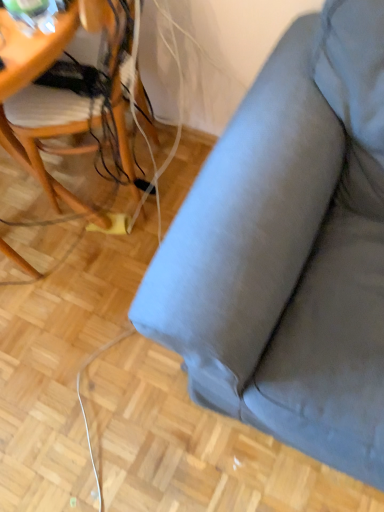
Question: From the image's perspective, is woodenchair at left below matte gray fabric couch at upper right?

Choices:
 (A) yes
 (B) no

Answer: (B)

Question: Is woodenchair at left taller than matte gray fabric couch at upper right?

Choices:
 (A) yes
 (B) no

Answer: (B)

Question: Can you confirm if woodenchair at left is wider than matte gray fabric couch at upper right?

Choices:
 (A) yes
 (B) no

Answer: (B)

Question: Could you tell me if woodenchair at left is turned towards matte gray fabric couch at upper right?

Choices:
 (A) no
 (B) yes

Answer: (A)

Question: Is woodenchair at left smaller than matte gray fabric couch at upper right?

Choices:
 (A) no
 (B) yes

Answer: (B)

Question: Is woodenchair at left to the right of matte gray fabric couch at upper right from the viewer's perspective?

Choices:
 (A) yes
 (B) no

Answer: (B)

Question: Is matte gray fabric couch at upper right smaller than woodenchair at left?

Choices:
 (A) yes
 (B) no

Answer: (B)

Question: Can we say matte gray fabric couch at upper right lies outside woodenchair at left?

Choices:
 (A) no
 (B) yes

Answer: (B)

Question: Considering the relative positions of matte gray fabric couch at upper right and woodenchair at left in the image provided, is matte gray fabric couch at upper right in front of woodenchair at left?

Choices:
 (A) no
 (B) yes

Answer: (B)

Question: Is matte gray fabric couch at upper right next to woodenchair at left and touching it?

Choices:
 (A) yes
 (B) no

Answer: (B)

Question: Is matte gray fabric couch at upper right oriented towards woodenchair at left?

Choices:
 (A) no
 (B) yes

Answer: (A)

Question: Does matte gray fabric couch at upper right appear on the left side of woodenchair at left?

Choices:
 (A) yes
 (B) no

Answer: (B)

Question: In terms of width, does matte gray fabric couch at upper right look wider or thinner when compared to woodenchair at left?

Choices:
 (A) wide
 (B) thin

Answer: (A)